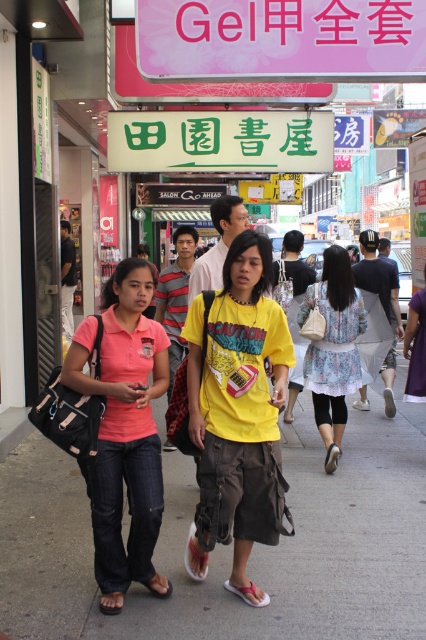
The height and width of the screenshot is (640, 426). Describe the element at coordinates (230, 547) in the screenshot. I see `gray concrete sidewalk at center` at that location.

Which is in front, point (317, 568) or point (94, 500)?

Positioned in front is point (94, 500).

Identify the location of gray concrete sidewalk at center. (230, 547).

Does gray concrete sidewalk at center lie behind yellow matte t-shirt at center?

That is False.

Does gray concrete sidewalk at center have a greater width compared to yellow matte t-shirt at center?

Correct, the width of gray concrete sidewalk at center exceeds that of yellow matte t-shirt at center.

Which is behind, point (325, 545) or point (198, 365)?

Positioned behind is point (325, 545).

This screenshot has width=426, height=640. I want to click on gray concrete sidewalk at center, so click(x=230, y=547).

Does point (258, 236) come closer to viewer compared to point (149, 515)?

No, it is not.

Which is more to the left, yellow matte t-shirt at center or pink fabric shirt at center?

pink fabric shirt at center

Is point (210, 337) positioned in front of point (121, 422)?

Yes.

This screenshot has height=640, width=426. Find the location of `yellow matte t-shirt at center`. yellow matte t-shirt at center is located at coordinates tap(236, 412).